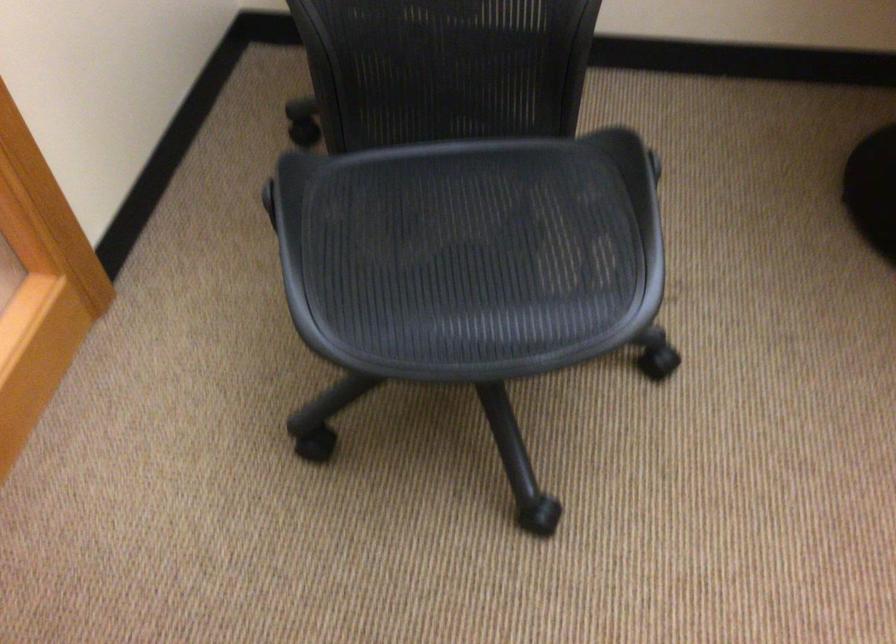
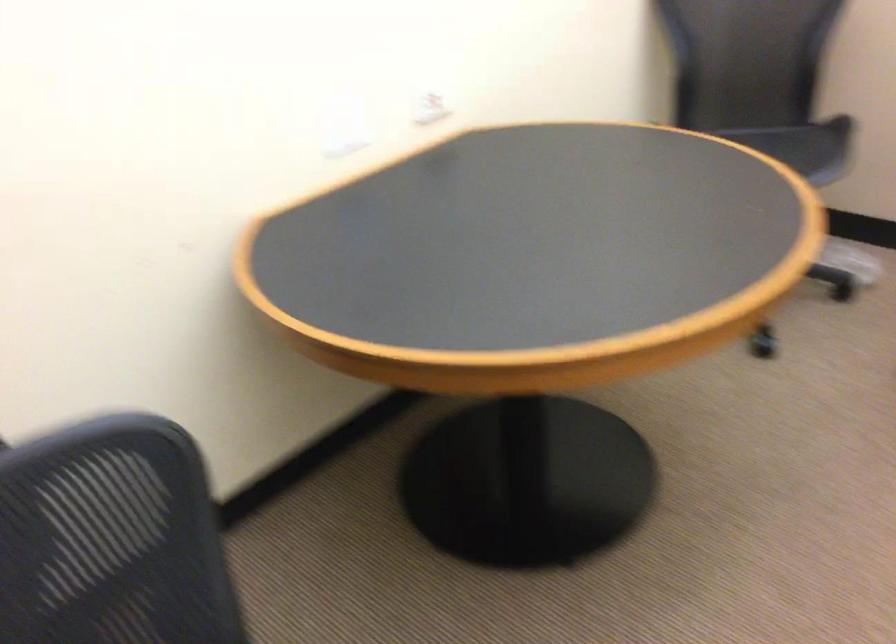
Question: The camera is either moving clockwise (left) or counter-clockwise (right) around the object. The first image is from the beginning of the video and the second image is from the end. Is the camera moving left or right when shooting the video?

Choices:
 (A) Left
 (B) Right

Answer: (A)